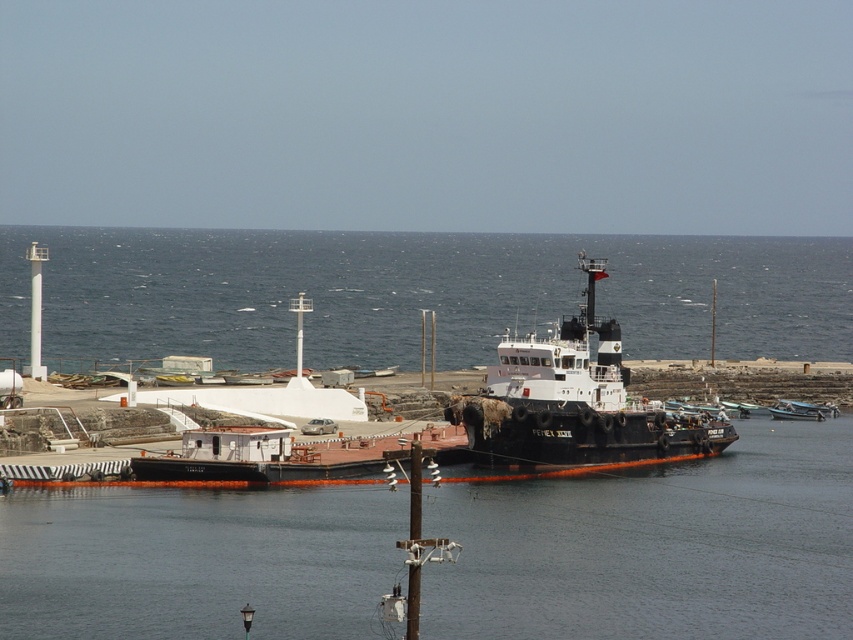
Question: Among these points, which one is nearest to the camera?

Choices:
 (A) (219, 401)
 (B) (376, 241)
 (C) (601, 364)

Answer: (C)

Question: Is blue water at center above white matte boat at center?

Choices:
 (A) no
 (B) yes

Answer: (B)

Question: Can you confirm if blue water at center is positioned above white matte boat at center?

Choices:
 (A) yes
 (B) no

Answer: (A)

Question: Can you confirm if black rubber boat at center is wider than white matte boat at center?

Choices:
 (A) no
 (B) yes

Answer: (B)

Question: Which point is closer to the camera taking this photo?

Choices:
 (A) (572, 372)
 (B) (202, 285)
 (C) (271, 394)

Answer: (A)

Question: Which is nearer to the blue water at center?

Choices:
 (A) white matte boat at center
 (B) black rubber boat at center

Answer: (A)